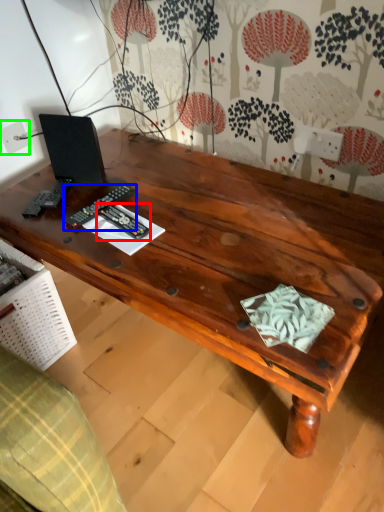
Question: Which object is positioned closest to control (highlighted by a red box)? Select from control (highlighted by a blue box) and electric outlet (highlighted by a green box).

Choices:
 (A) control
 (B) electric outlet

Answer: (A)